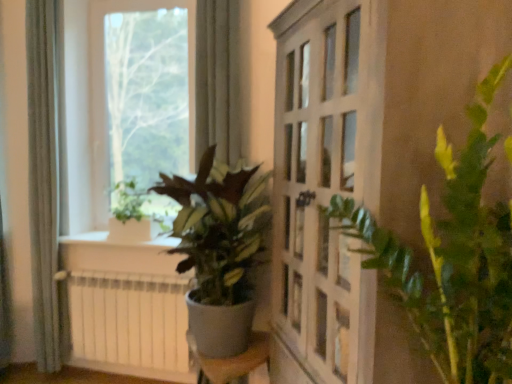
This screenshot has width=512, height=384. What do you see at coordinates (130, 322) in the screenshot?
I see `white matte radiator at lower left` at bounding box center [130, 322].

Locate an element on the screen. green leafy plant at right, the 3th houseplant when ordered from back to front is located at coordinates [x=451, y=258].

This screenshot has height=384, width=512. What do you see at coordinates (42, 177) in the screenshot?
I see `gray fabric curtain at left` at bounding box center [42, 177].

Locate an element on the screen. Image resolution: width=512 pixels, height=384 pixels. green matte plant at upper left, placed as the first houseplant when sorted from back to front is located at coordinates pos(137,214).

Where is `white matte radiator at lower left`? The width and height of the screenshot is (512, 384). white matte radiator at lower left is located at coordinates (130, 322).

Which of these two, white matte radiator at lower left or green leafy plant at right, the 3th houseplant when ordered from back to front, is thinner?

With smaller width is white matte radiator at lower left.

What are the coordinates of `radiator behind the green leafy plant at right, the 3th houseplant when ordered from back to front` in the screenshot? It's located at (130, 322).

Is white matte radiator at lower left far away from green leafy plant at right, which is the first houseplant from front to back?

That's right, there is a large distance between white matte radiator at lower left and green leafy plant at right, which is the first houseplant from front to back.

Between white glossy window sill at lower left and green matte plant at upper left, which is the third houseplant in front-to-back order, which one has smaller size?

Smaller between the two is white glossy window sill at lower left.

Which object is wider, white glossy window sill at lower left or green matte plant at upper left, which is the third houseplant in front-to-back order?

Wider between the two is white glossy window sill at lower left.

Is white glossy window sill at lower left facing towards green matte plant at upper left, which is the third houseplant in front-to-back order?

No, white glossy window sill at lower left is not facing towards green matte plant at upper left, which is the third houseplant in front-to-back order.

Is white glossy window sill at lower left behind green matte plant at upper left, which is the third houseplant in front-to-back order?

Yes, the depth of white glossy window sill at lower left is greater than that of green matte plant at upper left, which is the third houseplant in front-to-back order.

Is point (145, 192) positioned before point (476, 249)?

No, it is behind (476, 249).

Is green leafy plant at right, the 3th houseplant when ordered from back to front, completely or partially inside green matte plant at upper left, placed as the first houseplant when sorted from back to front?

Actually, green leafy plant at right, the 3th houseplant when ordered from back to front, is outside green matte plant at upper left, placed as the first houseplant when sorted from back to front.

How different are the orientations of green matte plant at upper left, which is the third houseplant in front-to-back order, and green leafy plant at right, the 3th houseplant when ordered from back to front, in degrees?

59.4 degrees.

Is green matte plant at upper left, placed as the first houseplant when sorted from back to front, placed right next to green leafy plant at right, which is the first houseplant from front to back?

No.

What's the angular difference between transparent glass window at upper left and green leafy plant at right, the 3th houseplant when ordered from back to front,'s facing directions?

60 degrees separate the facing orientations of transparent glass window at upper left and green leafy plant at right, the 3th houseplant when ordered from back to front.

Considering their positions, is transparent glass window at upper left located in front of or behind green leafy plant at right, which is the first houseplant from front to back?

Visually, transparent glass window at upper left is located behind green leafy plant at right, which is the first houseplant from front to back.

Is point (194, 123) closer to viewer compared to point (395, 278)?

No.

What are the coordinates of `the 1st houseplant directly beneath the transparent glass window at upper left (from a real-world perspective)` in the screenshot? It's located at (451, 258).

Does gray fabric curtain at left have a greater height compared to green leafy plant at right, which is the first houseplant from front to back?

Indeed, gray fabric curtain at left has a greater height compared to green leafy plant at right, which is the first houseplant from front to back.

From a real-world perspective, is gray fabric curtain at left above or below green leafy plant at right, the 3th houseplant when ordered from back to front?

gray fabric curtain at left is situated higher than green leafy plant at right, the 3th houseplant when ordered from back to front, in the real world.

How many degrees apart are the facing directions of gray fabric curtain at left and green leafy plant at right, the 3th houseplant when ordered from back to front?

The facing directions of gray fabric curtain at left and green leafy plant at right, the 3th houseplant when ordered from back to front, are 76.5 degrees apart.

Does point (48, 78) appear closer or farther from the camera than point (490, 325)?

Clearly, point (48, 78) is more distant from the camera than point (490, 325).

Who is more distant, green leafy plant at right, which is the first houseplant from front to back, or transparent glass window at upper left?

transparent glass window at upper left is more distant.

Would you consider green leafy plant at right, which is the first houseplant from front to back, to be distant from transparent glass window at upper left?

Yes, green leafy plant at right, which is the first houseplant from front to back, and transparent glass window at upper left are located far from each other.

Is green leafy plant at right, which is the first houseplant from front to back, at the right side of transparent glass window at upper left?

Correct, you'll find green leafy plant at right, which is the first houseplant from front to back, to the right of transparent glass window at upper left.

Is green leafy plant at right, the 3th houseplant when ordered from back to front, situated inside transparent glass window at upper left or outside?

green leafy plant at right, the 3th houseplant when ordered from back to front, lies outside transparent glass window at upper left.

Can you see green matte plant at upper left, which is the third houseplant in front-to-back order, touching white matte radiator at lower left?

green matte plant at upper left, which is the third houseplant in front-to-back order, and white matte radiator at lower left are not in contact.

Consider the image. Does green matte plant at upper left, placed as the first houseplant when sorted from back to front, lie in front of white matte radiator at lower left?

No, it is not.

The image size is (512, 384). In order to click on radiator below the green matte plant at upper left, which is the third houseplant in front-to-back order (from the image's perspective) in this screenshot , I will do `click(130, 322)`.

You are a GUI agent. You are given a task and a screenshot of the screen. Output one action in this format:
    pyautogui.click(x=<x>, y=<y>)
    Task: Click on the radiator on the left side of green leafy plant at right, the 3th houseplant when ordered from back to front
    The image size is (512, 384).
    Given the screenshot: What is the action you would take?
    pyautogui.click(x=130, y=322)

This screenshot has height=384, width=512. In order to click on the 1st houseplant in front of the white glossy window sill at lower left in this screenshot , I will do `click(137, 214)`.

Considering their positions, is white matte radiator at lower left positioned closer to green matte plant at center, the second houseplant in the back-to-front sequence, than white glossy window sill at lower left?

white matte radiator at lower left is closer to green matte plant at center, the second houseplant in the back-to-front sequence.

When comparing their distances from transparent glass window at upper left, does white matte radiator at lower left or green leafy plant at right, which is the first houseplant from front to back, seem further?

The object further to transparent glass window at upper left is green leafy plant at right, which is the first houseplant from front to back.

Consider the image. When comparing their distances from green matte plant at center, the second houseplant in the back-to-front sequence, does white glossy window sill at lower left or gray fabric curtain at left seem closer?

white glossy window sill at lower left is closer to green matte plant at center, the second houseplant in the back-to-front sequence.

Estimate the real-world distances between objects in this image. Which object is further from white matte radiator at lower left, gray fabric curtain at left or white glossy window sill at lower left?

gray fabric curtain at left is further to white matte radiator at lower left.

When comparing their distances from white glossy window sill at lower left, does green matte plant at upper left, which is the third houseplant in front-to-back order, or gray fabric curtain at left seem further?

gray fabric curtain at left.

When comparing their distances from green matte plant at upper left, placed as the first houseplant when sorted from back to front, does transparent glass window at upper left or white glossy window sill at lower left seem closer?

white glossy window sill at lower left is positioned closer to the anchor green matte plant at upper left, placed as the first houseplant when sorted from back to front.

Looking at the image, which one is located closer to transparent glass window at upper left, green matte plant at upper left, which is the third houseplant in front-to-back order, or white glossy window sill at lower left?

green matte plant at upper left, which is the third houseplant in front-to-back order, is closer to transparent glass window at upper left.

From the image, which object appears to be farther from gray fabric curtain at left, white glossy window sill at lower left or green matte plant at center, the second houseplant in the back-to-front sequence?

Among the two, green matte plant at center, the second houseplant in the back-to-front sequence, is located further to gray fabric curtain at left.

Locate an element on the screen. curtain between green leafy plant at right, which is the first houseplant from front to back, and green matte plant at upper left, placed as the first houseplant when sorted from back to front, from front to back is located at coordinates (42, 177).

This screenshot has width=512, height=384. What are the coordinates of `window sill between green matte plant at center, the second houseplant positioned from the front, and transparent glass window at upper left in the front-back direction` in the screenshot? It's located at (118, 241).

Find the location of a particular element. curtain located between green matte plant at center, the second houseplant in the back-to-front sequence, and transparent glass window at upper left in the depth direction is located at coordinates (42, 177).

Identify the location of curtain between green matte plant at center, the second houseplant positioned from the front, and white glossy window sill at lower left, along the z-axis. (42, 177).